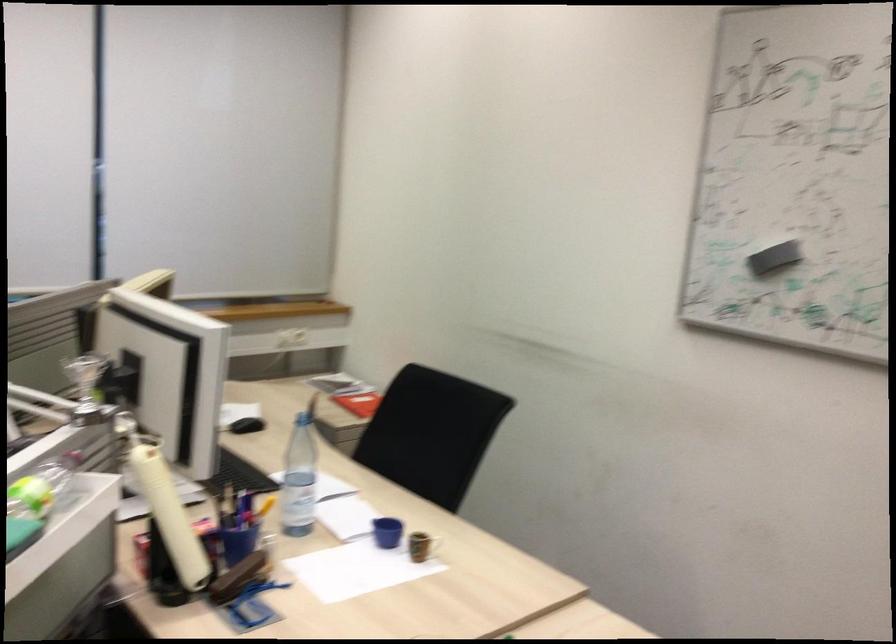
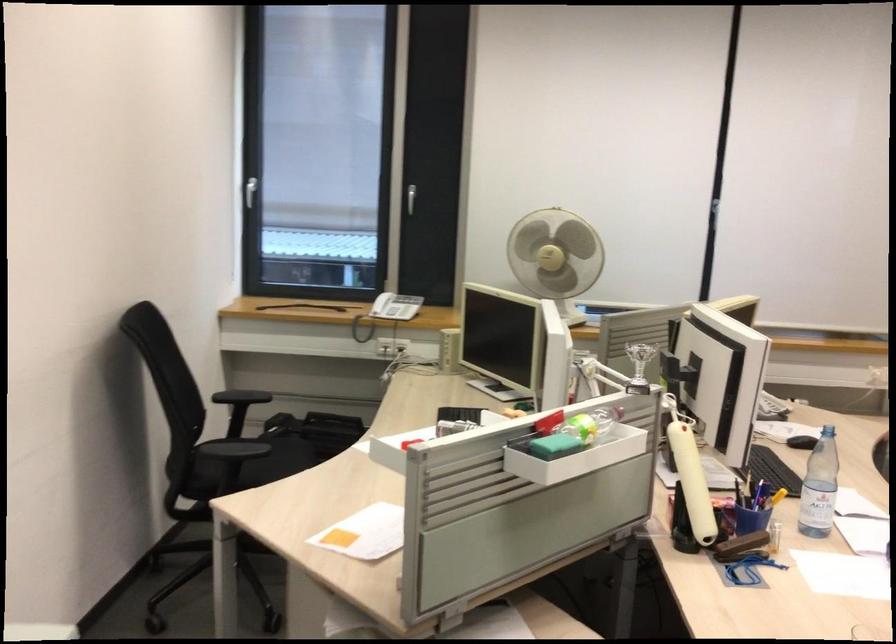
Find the pixel in the second image that matches (240,525) in the first image.

(752, 507)